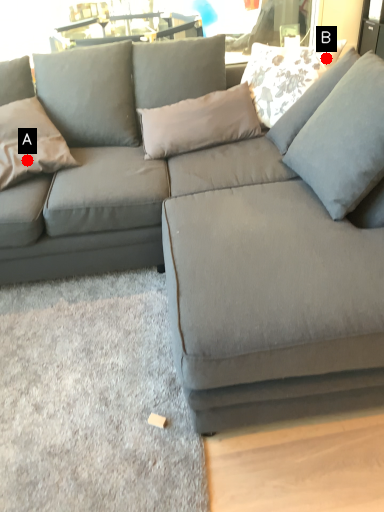
Question: Two points are circled on the image, labeled by A and B beside each circle. Which point appears closest to the camera in this image?

Choices:
 (A) A is closer
 (B) B is closer

Answer: (A)